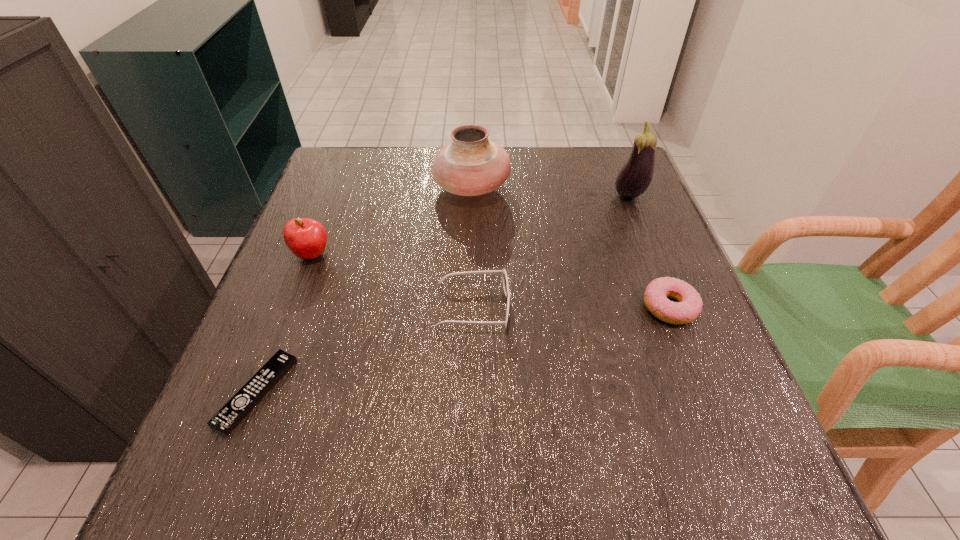
Identify the location of object located at the far right corner. (634, 178).

Find the location of a particular element. free space at the far edge of the desktop is located at coordinates (534, 190).

At what (x,y) coordinates should I click in order to perform the action: click on vacant space at the near edge of the desktop. Please return your answer as a coordinate pair (x, y). Looking at the image, I should click on (539, 448).

Locate an element on the screen. The height and width of the screenshot is (540, 960). free location at the left edge is located at coordinates (324, 211).

The width and height of the screenshot is (960, 540). I want to click on vacant space at the right edge, so click(x=615, y=246).

Image resolution: width=960 pixels, height=540 pixels. Identify the location of free space at the far left corner. tap(376, 150).

Find the location of a particular element. The width and height of the screenshot is (960, 540). free space at the far right corner is located at coordinates (605, 185).

Image resolution: width=960 pixels, height=540 pixels. Identify the location of vacant region at the near right corner of the desktop. (686, 464).

At what (x,y) coordinates should I click in order to perform the action: click on empty space that is in between the tallest object and the second tallest object. Please return your answer as a coordinate pair (x, y). This screenshot has height=540, width=960. Looking at the image, I should click on (550, 191).

Where is `vacant space in between the doughnut and the fifth shortest object`? vacant space in between the doughnut and the fifth shortest object is located at coordinates (570, 247).